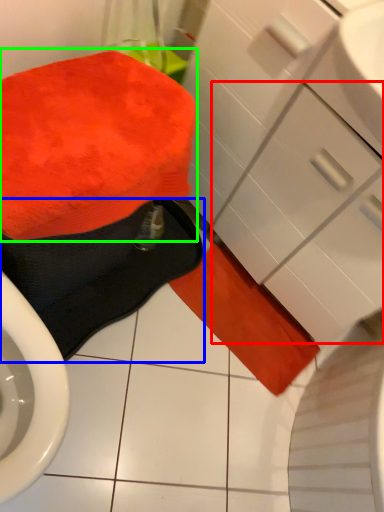
Question: Considering the real-world distances, which object is closest to drawer (highlighted by a red box)? bath towel (highlighted by a blue box) or bath towel (highlighted by a green box).

Choices:
 (A) bath towel
 (B) bath towel

Answer: (B)